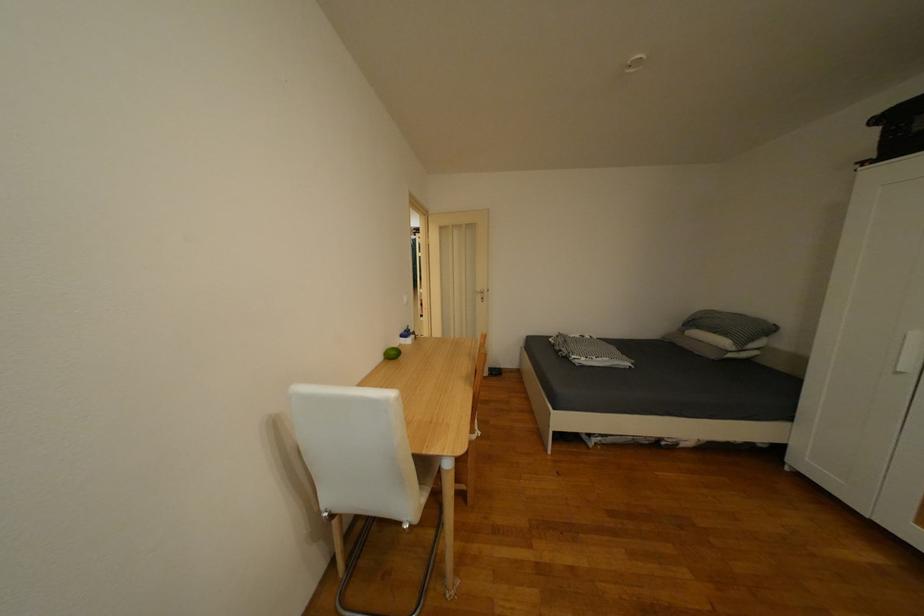
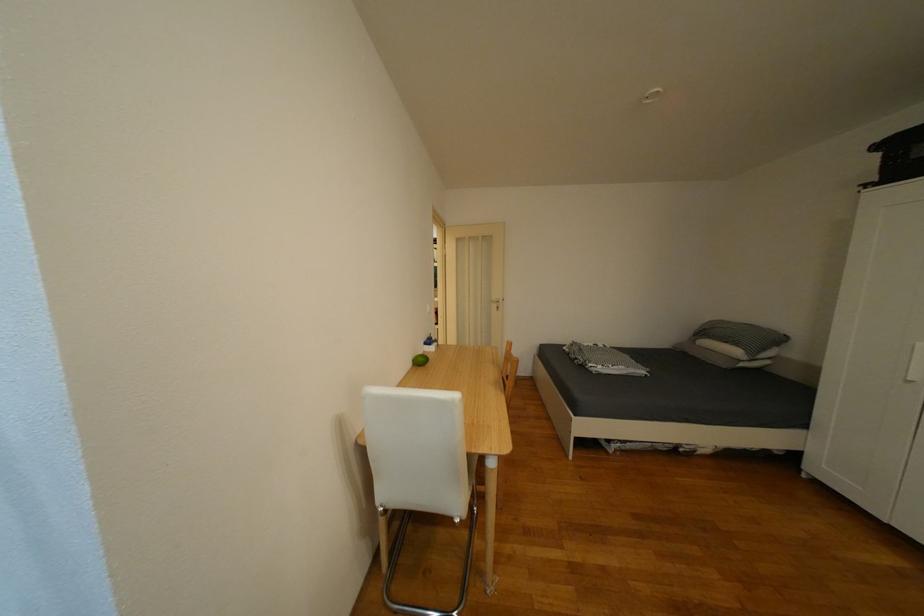
The point at (487, 298) is marked in the first image. Where is the corresponding point in the second image?

(503, 307)